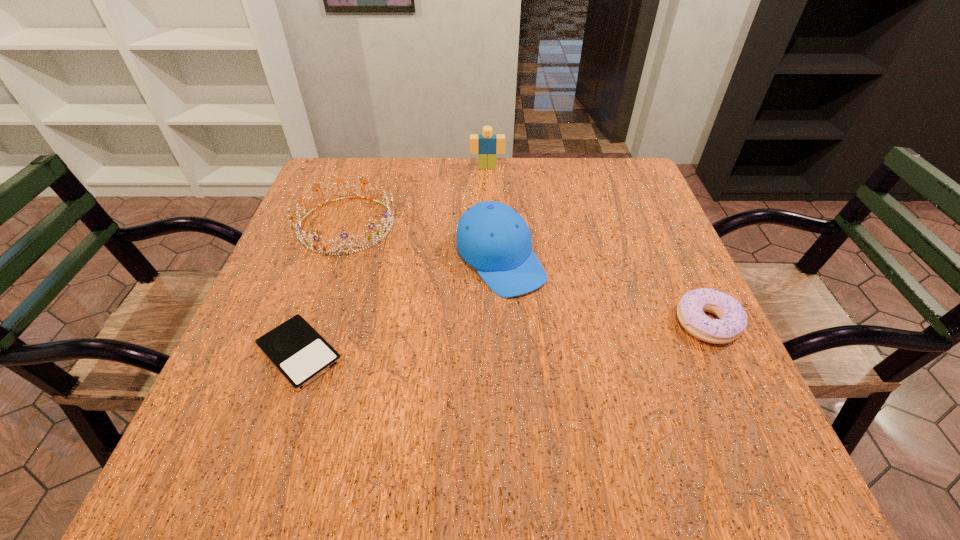
Locate an element on the screen. iPod is located at coordinates tap(295, 348).

The width and height of the screenshot is (960, 540). I want to click on doughnut, so click(732, 321).

At what (x,y) coordinates should I click in order to perform the action: click on the second shortest object. Please return your answer as a coordinate pair (x, y). This screenshot has height=540, width=960. Looking at the image, I should click on (732, 321).

At what (x,y) coordinates should I click in order to perform the action: click on tiara. Please return your answer as a coordinate pair (x, y). This screenshot has height=540, width=960. Looking at the image, I should click on (379, 235).

The image size is (960, 540). What are the coordinates of `cap` in the screenshot? It's located at (492, 237).

I want to click on Lego, so click(487, 145).

Locate an element on the screen. Image resolution: width=960 pixels, height=540 pixels. vacant region located on the back of the shortest object is located at coordinates (346, 222).

At what (x,y) coordinates should I click in order to perform the action: click on vacant space located 0.190m on the back of the rightmost object. Please return your answer as a coordinate pair (x, y). Looking at the image, I should click on 668,240.

Locate an element on the screen. vacant space situated on the front-facing side of the third tallest object is located at coordinates (484, 332).

Locate an element on the screen. The height and width of the screenshot is (540, 960). free space located on the front-facing side of the third tallest object is located at coordinates (462, 315).